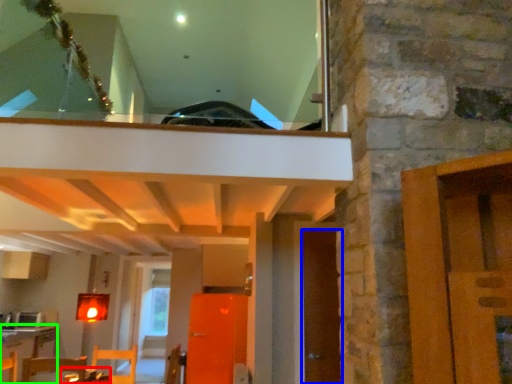
Question: Which object is positioned closest to table (highlighted by a red box)? Select from door (highlighted by a blue box) and table (highlighted by a green box).

Choices:
 (A) door
 (B) table

Answer: (A)